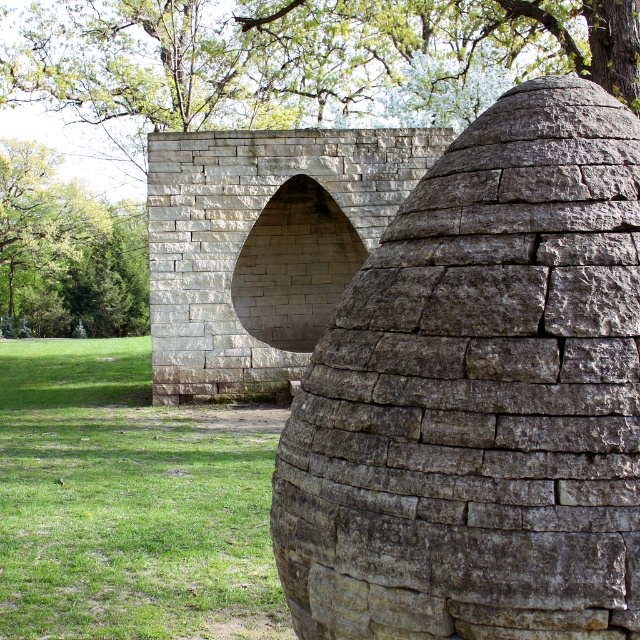
Question: Can you confirm if gray stone dome at center is positioned to the right of green grass at lower left?

Choices:
 (A) yes
 (B) no

Answer: (A)

Question: Which is nearer to the green leafy tree at upper left?

Choices:
 (A) gray stone dome at center
 (B) green grass at lower left

Answer: (B)

Question: Is green grass at lower left above green leafy tree at upper left?

Choices:
 (A) no
 (B) yes

Answer: (A)

Question: Which object is the farthest from the green leafy tree at upper left?

Choices:
 (A) gray stone dome at center
 (B) green grass at lower left

Answer: (A)

Question: Is green grass at lower left smaller than green leafy tree at upper left?

Choices:
 (A) yes
 (B) no

Answer: (A)

Question: Which is farther from the gray stone dome at center?

Choices:
 (A) green grass at lower left
 (B) green leafy tree at upper left

Answer: (B)